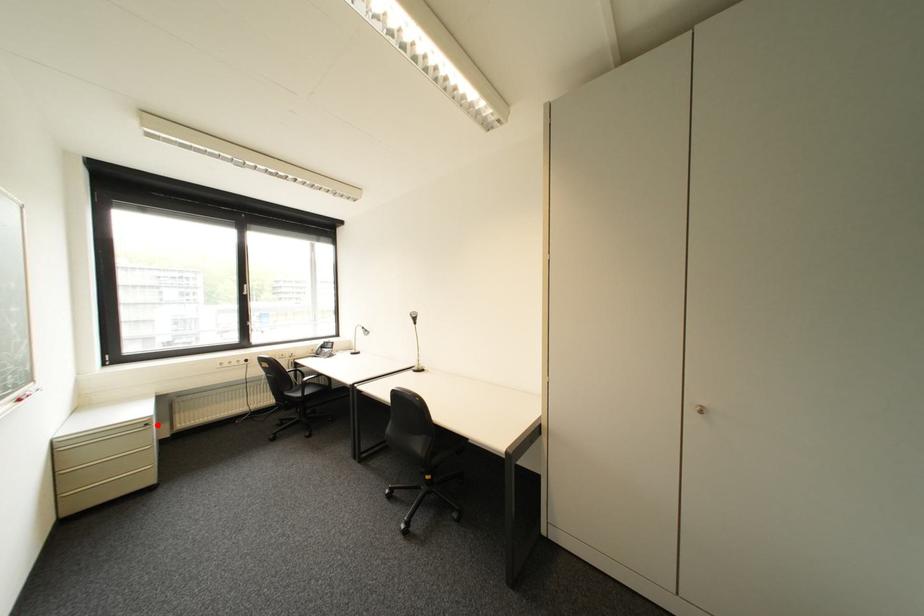
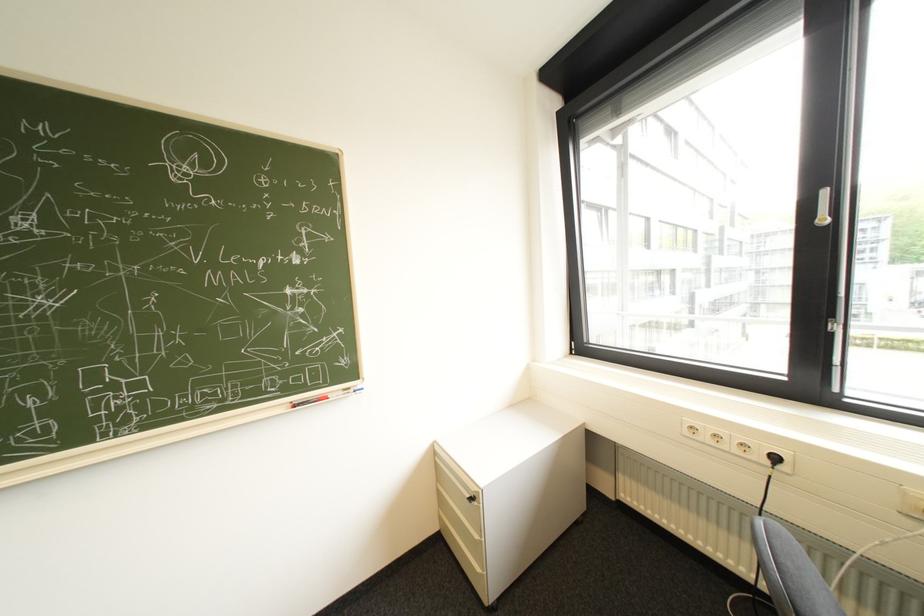
Find the pixel in the second image that matches the highlighted location in the first image.

(482, 499)